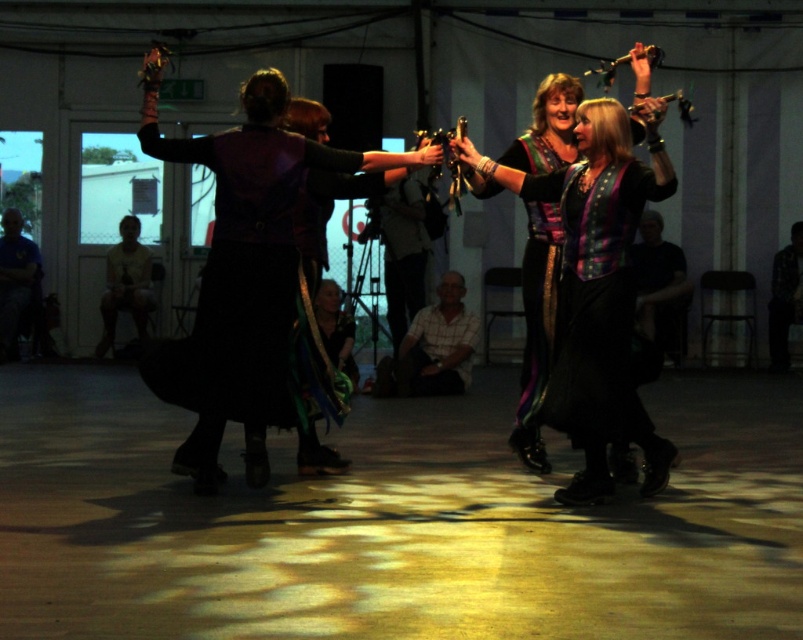
Question: Based on their relative distances, which object is nearer to the white checkered shirt at center?

Choices:
 (A) dark gray shirt at center
 (B) light yellow t-shirt at lower left
 (C) shiny black vest at center
 (D) matte purple vest at center

Answer: (A)

Question: Can you confirm if white checkered shirt at center is positioned above light yellow t-shirt at lower left?

Choices:
 (A) yes
 (B) no

Answer: (B)

Question: Is matte purple vest at center positioned in front of shiny black vest at center?

Choices:
 (A) no
 (B) yes

Answer: (A)

Question: Which of the following is the farthest from the observer?

Choices:
 (A) matte purple vest at center
 (B) blue shirt at lower left
 (C) shiny black vest at center

Answer: (B)

Question: Is matte purple vest at center to the right of white checkered shirt at center from the viewer's perspective?

Choices:
 (A) yes
 (B) no

Answer: (B)

Question: Which point is farther from the camera taking this photo?

Choices:
 (A) (218, 253)
 (B) (145, 337)

Answer: (B)